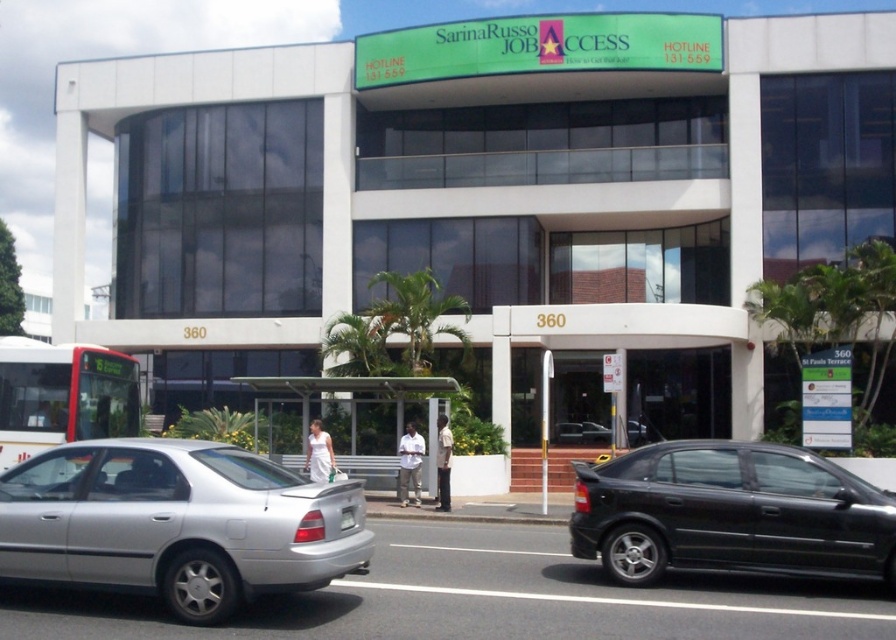
You are a delivery driver approaching the building and need to park your vehicle. You see a silver metallic sedan at lower left and a black glossy sedan at lower right. Which parking spot should you choose to park your car without blocking the entrance?

You should park your car in the parking spot to the right of the silver metallic sedan at lower left, as it is positioned to the left of the black glossy sedan at lower right, leaving space near the entrance unobstructed.

You are a delivery driver who needs to park your vehicle in the parking spot reserved for compact cars. The compact car parking space is only 4.5 meters long. You have two vehicles in front of you, the silver metallic sedan at lower left and the black glossy sedan at lower right. Which vehicle should you choose to park in the compact car spot?

The silver metallic sedan at lower left is shorter than the black glossy sedan at lower right, so you should choose the silver metallic sedan at lower left to park in the compact car spot since it is shorter and fits within the 4.5 meters length requirement.

You are a pedestrian standing in front of the modern building. You see a black glossy sedan at lower right and a white matte bus at left. Which vehicle is positioned to the right side of the other?

The black glossy sedan at lower right is positioned to the right of the white matte bus at left.